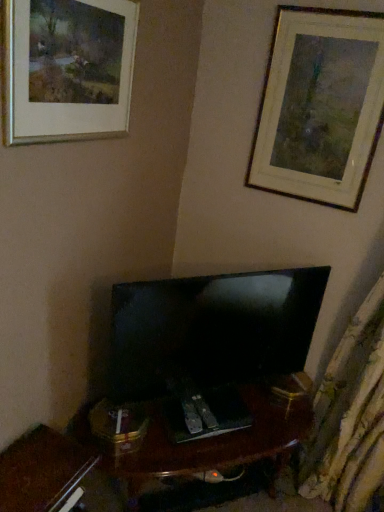
Image resolution: width=384 pixels, height=512 pixels. Find the location of `silver metallic picture frame at upper left, marked as the first picture frame in a left-to-right arrangement`. silver metallic picture frame at upper left, marked as the first picture frame in a left-to-right arrangement is located at coordinates (68, 68).

In order to face wooden picture frame at upper right, which ranks as the first picture frame in right-to-left order, should I rotate leftwards or rightwards?

Turn right approximately 16.667 degrees to face it.

This screenshot has height=512, width=384. I want to click on matte black tv at center, so click(212, 328).

Locate an element on the screen. silver metallic picture frame at upper left, marked as the first picture frame in a left-to-right arrangement is located at coordinates (68, 68).

At what (x,y) coordinates should I click in order to perform the action: click on the 2nd picture frame above when counting from the matte black tv at center (from the image's perspective). Please return your answer as a coordinate pair (x, y). This screenshot has width=384, height=512. Looking at the image, I should click on (320, 105).

Between wooden picture frame at upper right, which ranks as the first picture frame in right-to-left order, and matte black tv at center, which one is positioned in front?

matte black tv at center is more forward.

From the image's perspective, which is above, wooden picture frame at upper right, positioned as the 1th picture frame in back-to-front order, or matte black tv at center?

wooden picture frame at upper right, positioned as the 1th picture frame in back-to-front order.

Does wooden picture frame at upper right, which is the second picture frame from front to back, have a larger size compared to matte black tv at center?

Actually, wooden picture frame at upper right, which is the second picture frame from front to back, might be smaller than matte black tv at center.

Consider the image. Which of these two, wooden picture frame at upper right, positioned as the 1th picture frame in back-to-front order, or silver metallic picture frame at upper left, marked as the first picture frame in a left-to-right arrangement, is bigger?

With larger size is silver metallic picture frame at upper left, marked as the first picture frame in a left-to-right arrangement.

Considering the sizes of objects wooden picture frame at upper right, positioned as the 1th picture frame in back-to-front order, and silver metallic picture frame at upper left, marked as the first picture frame in a left-to-right arrangement, in the image provided, who is taller, wooden picture frame at upper right, positioned as the 1th picture frame in back-to-front order, or silver metallic picture frame at upper left, marked as the first picture frame in a left-to-right arrangement,?

wooden picture frame at upper right, positioned as the 1th picture frame in back-to-front order.

Consider the image. Which object is positioned more to the left, wooden picture frame at upper right, positioned as the 2th picture frame in left-to-right order, or silver metallic picture frame at upper left, marked as the first picture frame in a left-to-right arrangement?

Positioned to the left is silver metallic picture frame at upper left, marked as the first picture frame in a left-to-right arrangement.

Which object is further away from the camera, wooden picture frame at upper right, which ranks as the first picture frame in right-to-left order, or silver metallic picture frame at upper left, the 2th picture frame from the back?

wooden picture frame at upper right, which ranks as the first picture frame in right-to-left order.

Does silver metallic picture frame at upper left, which appears as the 2th picture frame when viewed from the right, have a smaller size compared to wooden picture frame at upper right, positioned as the 2th picture frame in left-to-right order?

Actually, silver metallic picture frame at upper left, which appears as the 2th picture frame when viewed from the right, might be larger than wooden picture frame at upper right, positioned as the 2th picture frame in left-to-right order.

From a real-world perspective, which is physically below, silver metallic picture frame at upper left, which appears as the 2th picture frame when viewed from the right, or wooden picture frame at upper right, positioned as the 1th picture frame in back-to-front order?

wooden picture frame at upper right, positioned as the 1th picture frame in back-to-front order, is physically lower.

Are silver metallic picture frame at upper left, which appears as the 2th picture frame when viewed from the right, and wooden picture frame at upper right, positioned as the 1th picture frame in back-to-front order, located far from each other?

silver metallic picture frame at upper left, which appears as the 2th picture frame when viewed from the right, is near wooden picture frame at upper right, positioned as the 1th picture frame in back-to-front order, not far away.

In the scene shown: Is silver metallic picture frame at upper left, the 2th picture frame from the back, turned away from wooden picture frame at upper right, which is the second picture frame from front to back?

No, wooden picture frame at upper right, which is the second picture frame from front to back, is not at the back of silver metallic picture frame at upper left, the 2th picture frame from the back.

In the image, is silver metallic picture frame at upper left, the 2th picture frame from the back, positioned in front of or behind matte black tv at center?

silver metallic picture frame at upper left, the 2th picture frame from the back, is positioned closer to the viewer than matte black tv at center.

At what (x,y) coordinates should I click in order to perform the action: click on picture frame that is in front of the matte black tv at center. Please return your answer as a coordinate pair (x, y). This screenshot has height=512, width=384. Looking at the image, I should click on (68, 68).

Is silver metallic picture frame at upper left, which appears as the 2th picture frame when viewed from the right, oriented away from matte black tv at center?

silver metallic picture frame at upper left, which appears as the 2th picture frame when viewed from the right, does not have its back to matte black tv at center.

Looking at this image, from the image's perspective, is silver metallic picture frame at upper left, which appears as the 1th picture frame when viewed from the front, beneath matte black tv at center?

Actually, silver metallic picture frame at upper left, which appears as the 1th picture frame when viewed from the front, appears above matte black tv at center in the image.

Which is closer, (x=301, y=309) or (x=324, y=33)?

Point (x=301, y=309).

From the image's perspective, does matte black tv at center appear lower than wooden picture frame at upper right, positioned as the 1th picture frame in back-to-front order?

Correct, matte black tv at center appears lower than wooden picture frame at upper right, positioned as the 1th picture frame in back-to-front order, in the image.

Is matte black tv at center completely or partially outside of wooden picture frame at upper right, positioned as the 1th picture frame in back-to-front order?

Indeed, matte black tv at center is completely outside wooden picture frame at upper right, positioned as the 1th picture frame in back-to-front order.

Can you confirm if matte black tv at center is taller than silver metallic picture frame at upper left, the 2th picture frame from the back?

Yes, matte black tv at center is taller than silver metallic picture frame at upper left, the 2th picture frame from the back.

Identify the location of picture frame in front of the matte black tv at center. The image size is (384, 512). (68, 68).

Is there a large distance between matte black tv at center and silver metallic picture frame at upper left, which appears as the 2th picture frame when viewed from the right?

No, there isn't a large distance between matte black tv at center and silver metallic picture frame at upper left, which appears as the 2th picture frame when viewed from the right.

How many degrees apart are the facing directions of matte black tv at center and silver metallic picture frame at upper left, which appears as the 1th picture frame when viewed from the front?

matte black tv at center and silver metallic picture frame at upper left, which appears as the 1th picture frame when viewed from the front, are facing 40.9 degrees away from each other.

From a real-world perspective, count 1st picture frames upward from the matte black tv at center and point to it. Please provide its 2D coordinates.

[(320, 105)]

Locate an element on the screen. picture frame above the silver metallic picture frame at upper left, marked as the first picture frame in a left-to-right arrangement (from the image's perspective) is located at coordinates pyautogui.click(x=320, y=105).

From the picture: When comparing their distances from wooden picture frame at upper right, positioned as the 1th picture frame in back-to-front order, does matte black tv at center or silver metallic picture frame at upper left, which appears as the 1th picture frame when viewed from the front, seem closer?

The object closer to wooden picture frame at upper right, positioned as the 1th picture frame in back-to-front order, is matte black tv at center.

Looking at the image, which one is located closer to matte black tv at center, wooden picture frame at upper right, which is the second picture frame from front to back, or silver metallic picture frame at upper left, which appears as the 1th picture frame when viewed from the front?

Among the two, wooden picture frame at upper right, which is the second picture frame from front to back, is located nearer to matte black tv at center.

When comparing their distances from matte black tv at center, does silver metallic picture frame at upper left, which appears as the 1th picture frame when viewed from the front, or wooden picture frame at upper right, positioned as the 1th picture frame in back-to-front order, seem closer?

wooden picture frame at upper right, positioned as the 1th picture frame in back-to-front order, is closer to matte black tv at center.

Which object lies nearer to the anchor point silver metallic picture frame at upper left, the 2th picture frame from the back, wooden picture frame at upper right, positioned as the 1th picture frame in back-to-front order, or matte black tv at center?

Based on the image, matte black tv at center appears to be nearer to silver metallic picture frame at upper left, the 2th picture frame from the back.

Considering their positions, is silver metallic picture frame at upper left, marked as the first picture frame in a left-to-right arrangement, positioned closer to wooden picture frame at upper right, positioned as the 2th picture frame in left-to-right order, than matte black tv at center?

matte black tv at center is closer to wooden picture frame at upper right, positioned as the 2th picture frame in left-to-right order.

Looking at the image, which one is located further to silver metallic picture frame at upper left, which appears as the 1th picture frame when viewed from the front, matte black tv at center or wooden picture frame at upper right, which ranks as the first picture frame in right-to-left order?

The object further to silver metallic picture frame at upper left, which appears as the 1th picture frame when viewed from the front, is wooden picture frame at upper right, which ranks as the first picture frame in right-to-left order.

Locate an element on the screen. The width and height of the screenshot is (384, 512). picture frame that lies between wooden picture frame at upper right, positioned as the 1th picture frame in back-to-front order, and matte black tv at center from top to bottom is located at coordinates (68, 68).